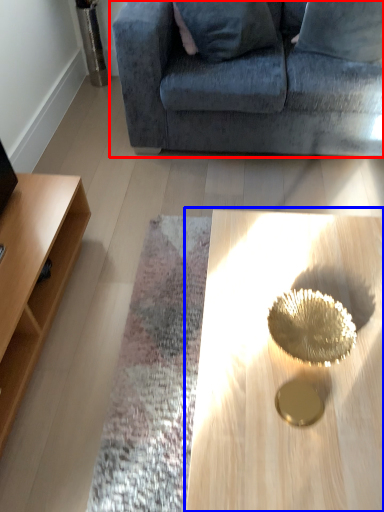
Question: Which of the following is the farthest to the observer, studio couch (highlighted by a red box) or coffee table (highlighted by a blue box)?

Choices:
 (A) studio couch
 (B) coffee table

Answer: (A)